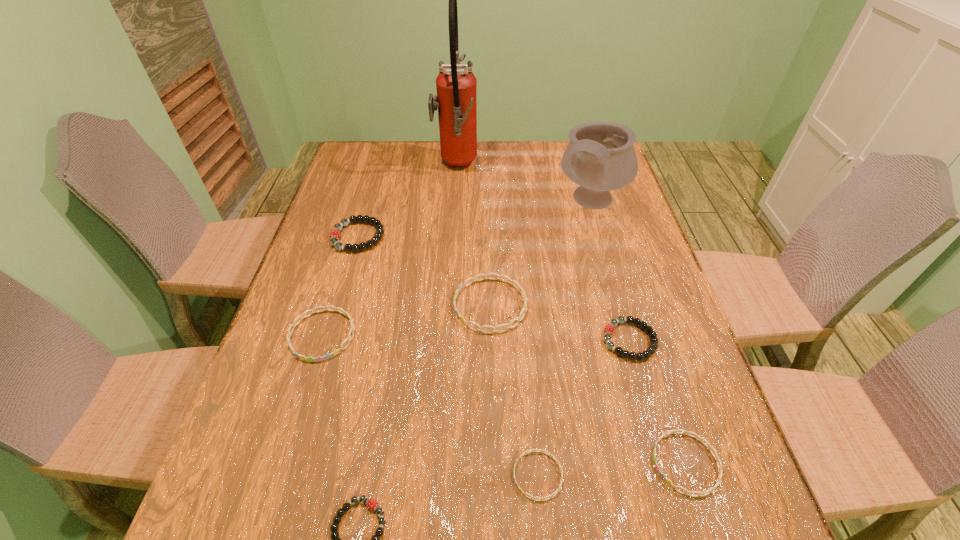
Image resolution: width=960 pixels, height=540 pixels. I want to click on the smallest blue bracelet, so click(531, 450).

Where is `the shortest bracelet`? The width and height of the screenshot is (960, 540). the shortest bracelet is located at coordinates (531, 450).

This screenshot has width=960, height=540. What are the coordinates of `vacant space situated 0.200m at the nozzle of the fire extinguisher` in the screenshot? It's located at (537, 167).

I want to click on free location located on the front of the brown pottery, so click(618, 293).

Image resolution: width=960 pixels, height=540 pixels. Find the location of `free space located on the surface of the biggest blue bracelet showing star-shaped elements`. free space located on the surface of the biggest blue bracelet showing star-shaped elements is located at coordinates (420, 305).

The height and width of the screenshot is (540, 960). In order to click on vacant area located on the surface of the biggest blue bracelet showing star-shaped elements in this screenshot , I will do coord(433,305).

Find the location of a particular element. This screenshot has height=540, width=960. vacant space located on the surface of the biggest blue bracelet showing star-shaped elements is located at coordinates (388, 305).

You are a GUI agent. You are given a task and a screenshot of the screen. Output one action in this format:
    pyautogui.click(x=<x>, y=<y>)
    Task: Click on the vacant position located on the back of the leftmost black bracelet
    The width and height of the screenshot is (960, 540).
    Given the screenshot: What is the action you would take?
    pyautogui.click(x=378, y=166)

At what (x,y) coordinates should I click in order to perform the action: click on free spot located 0.070m on the surface of the leftmost blue bracelet showing star-shaped elements. Please return your answer as a coordinate pair (x, y). The image size is (960, 540). Looking at the image, I should click on (304, 392).

Identify the location of free space located 0.070m on the front of the rightmost black bracelet. The image size is (960, 540). (644, 392).